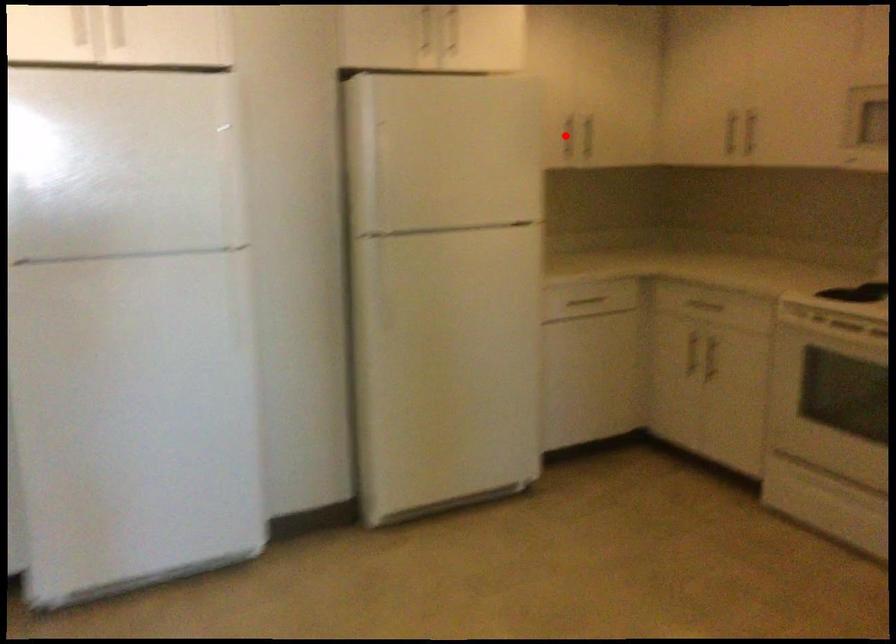
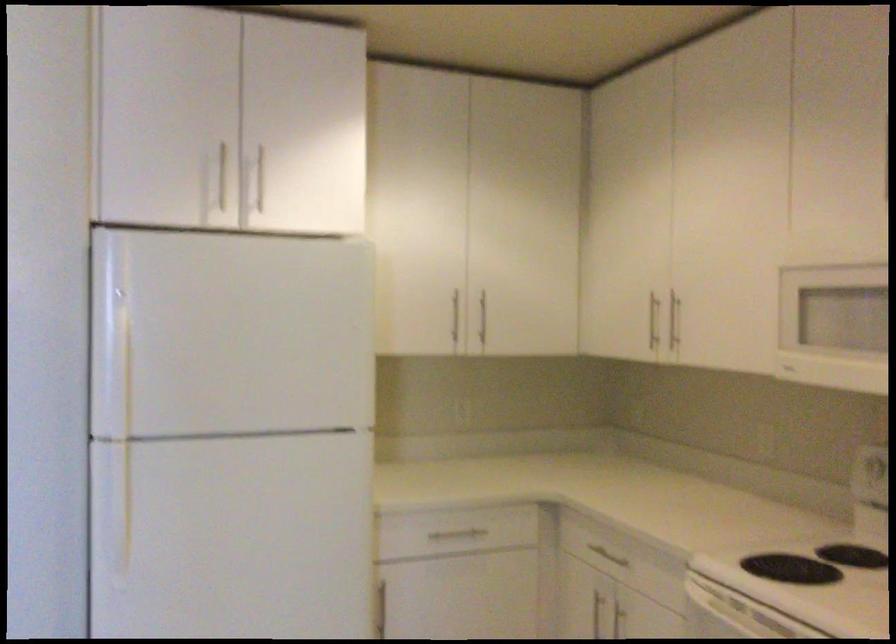
Question: I am providing you with two images of the same scene from different viewpoints. A red point is marked on the first image. Can you still see the location of the red point in image 2?

Choices:
 (A) Yes
 (B) No

Answer: (A)